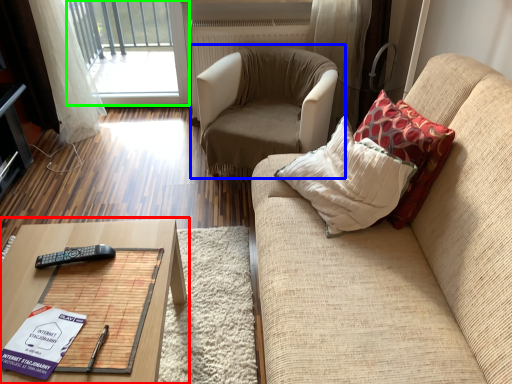
Question: Based on their relative distances, which object is farther from table (highlighted by a red box)? Choose from chair (highlighted by a blue box) and window (highlighted by a green box).

Choices:
 (A) chair
 (B) window

Answer: (B)